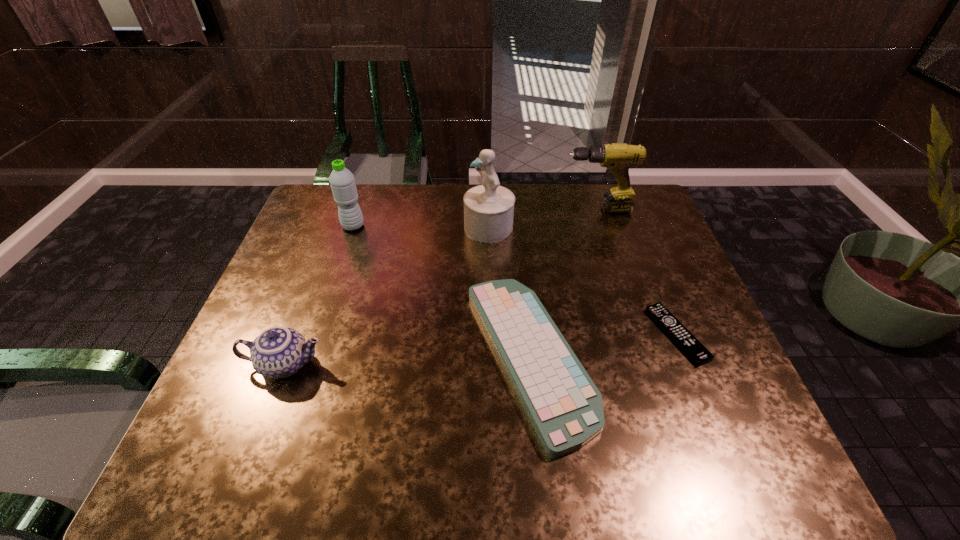
This screenshot has height=540, width=960. What are the coordinates of `figurine` in the screenshot? It's located at (488, 208).

Find the location of a particular element. drill is located at coordinates tap(617, 157).

The image size is (960, 540). In order to click on water bottle in this screenshot , I will do `click(342, 182)`.

You are a GUI agent. You are given a task and a screenshot of the screen. Output one action in this format:
    pyautogui.click(x=<x>, y=<y>)
    Task: Click on the chinaware
    
    Given the screenshot: What is the action you would take?
    pyautogui.click(x=278, y=352)

Where is `the fifth tallest object`? The height and width of the screenshot is (540, 960). the fifth tallest object is located at coordinates tap(565, 407).

What are the coordinates of `the shortest object` in the screenshot? It's located at (681, 336).

This screenshot has width=960, height=540. I want to click on free spot located 0.090m at the beak of the figurine, so click(435, 228).

You are a GUI agent. You are given a task and a screenshot of the screen. Output one action in this format:
    pyautogui.click(x=<x>, y=<y>)
    Task: Click on the free space located 0.340m at the beak of the figurine
    
    Given the screenshot: What is the action you would take?
    pyautogui.click(x=354, y=228)

The height and width of the screenshot is (540, 960). Find the location of `vacant region located at the beak of the figurine`. vacant region located at the beak of the figurine is located at coordinates (335, 228).

Image resolution: width=960 pixels, height=540 pixels. In order to click on vacant region located on the handle side of the drill in this screenshot , I will do `click(524, 210)`.